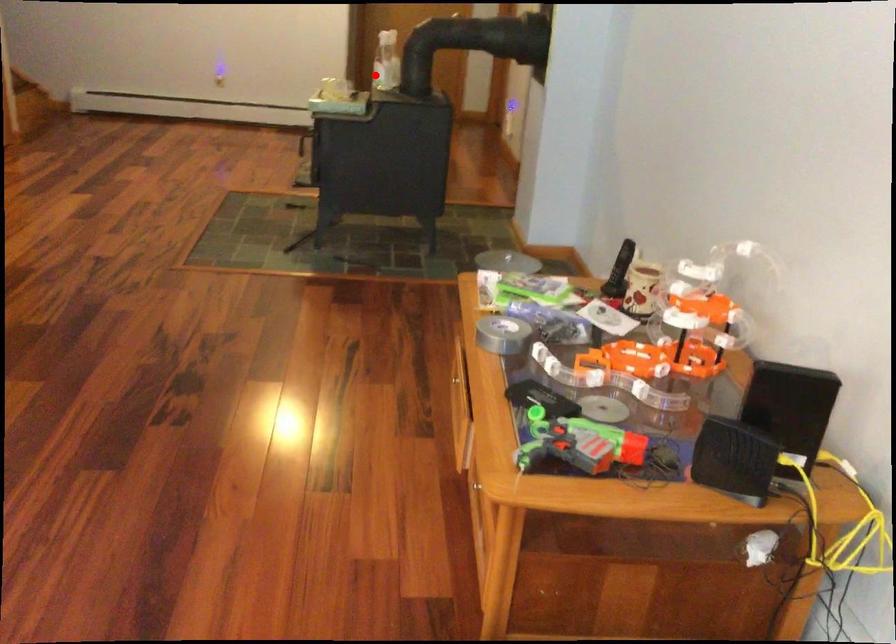
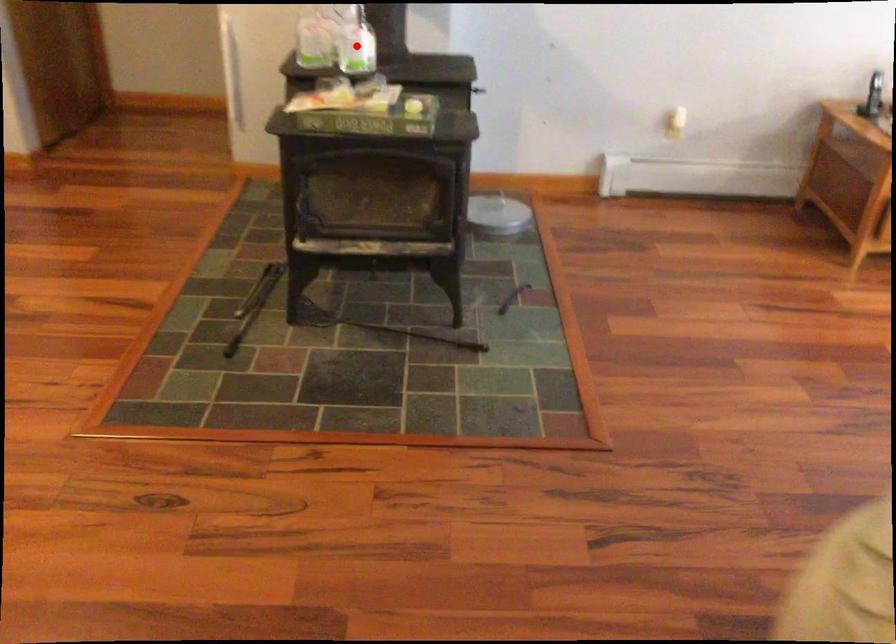
I am providing you with two images of the same scene from different viewpoints. A red point is marked on the first image and another point is marked on the second image. Is the marked point in image1 the same physical position as the marked point in image2?

Yes